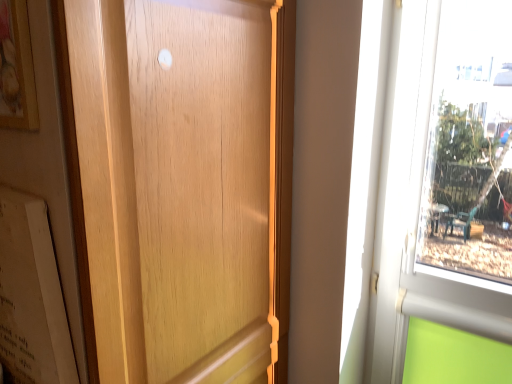
Question: Considering the relative positions of wooden door at center and wooden picture frame at upper left in the image provided, is wooden door at center to the right of wooden picture frame at upper left from the viewer's perspective?

Choices:
 (A) yes
 (B) no

Answer: (A)

Question: Does wooden door at center have a lesser width compared to wooden picture frame at upper left?

Choices:
 (A) no
 (B) yes

Answer: (A)

Question: Does wooden door at center contain wooden picture frame at upper left?

Choices:
 (A) no
 (B) yes

Answer: (B)

Question: Is wooden door at center positioned beyond the bounds of wooden picture frame at upper left?

Choices:
 (A) no
 (B) yes

Answer: (B)

Question: Is wooden door at center smaller than wooden picture frame at upper left?

Choices:
 (A) yes
 (B) no

Answer: (B)

Question: From the image's perspective, is wooden door at center located above or below wooden picture frame at upper left?

Choices:
 (A) below
 (B) above

Answer: (A)

Question: Based on their sizes in the image, would you say wooden door at center is bigger or smaller than wooden picture frame at upper left?

Choices:
 (A) small
 (B) big

Answer: (B)

Question: Is wooden door at center inside or outside of wooden picture frame at upper left?

Choices:
 (A) inside
 (B) outside

Answer: (B)

Question: Visually, is wooden door at center positioned to the left or to the right of wooden picture frame at upper left?

Choices:
 (A) right
 (B) left

Answer: (A)

Question: Considering the positions of wooden picture frame at upper left and matte white paper at left in the image, is wooden picture frame at upper left wider or thinner than matte white paper at left?

Choices:
 (A) thin
 (B) wide

Answer: (A)

Question: Considering the positions of point (10, 46) and point (57, 347), is point (10, 46) closer or farther from the camera than point (57, 347)?

Choices:
 (A) closer
 (B) farther

Answer: (A)

Question: From a real-world perspective, is wooden picture frame at upper left above or below matte white paper at left?

Choices:
 (A) above
 (B) below

Answer: (A)

Question: Considering the relative positions of wooden picture frame at upper left and matte white paper at left in the image provided, is wooden picture frame at upper left to the left or to the right of matte white paper at left?

Choices:
 (A) right
 (B) left

Answer: (A)

Question: In terms of width, does matte white paper at left look wider or thinner when compared to wooden picture frame at upper left?

Choices:
 (A) wide
 (B) thin

Answer: (A)

Question: In terms of height, does matte white paper at left look taller or shorter compared to wooden picture frame at upper left?

Choices:
 (A) tall
 (B) short

Answer: (A)